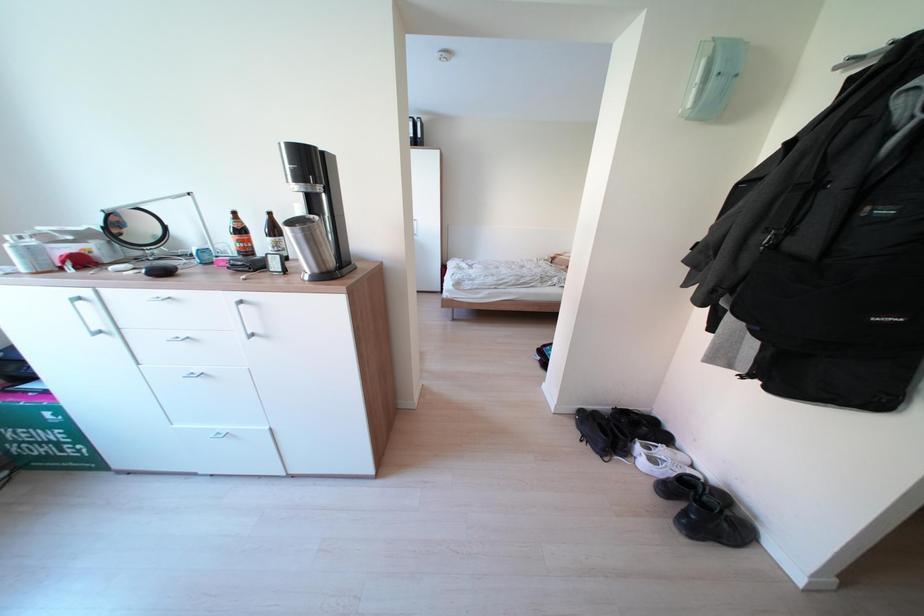
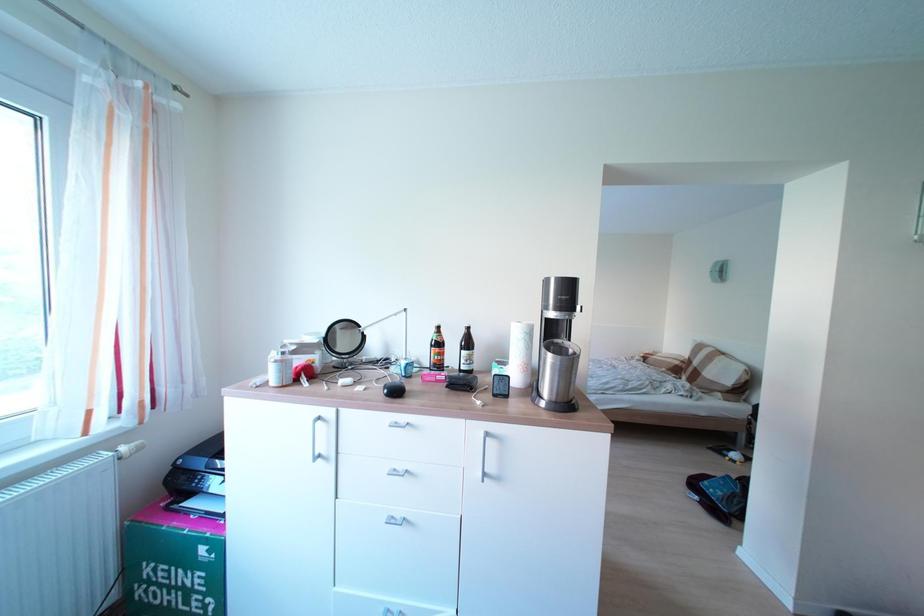
Question: Which direction would the cameraman need to move to produce the second image? Reply with the corresponding letter.

Choices:
 (A) Left
 (B) Right
 (C) Forward
 (D) Backward

Answer: (A)